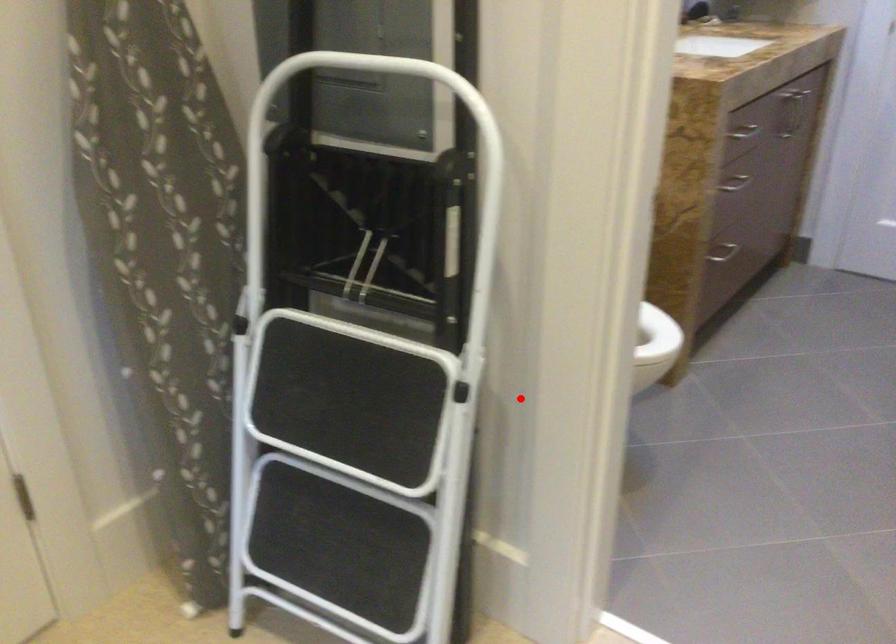
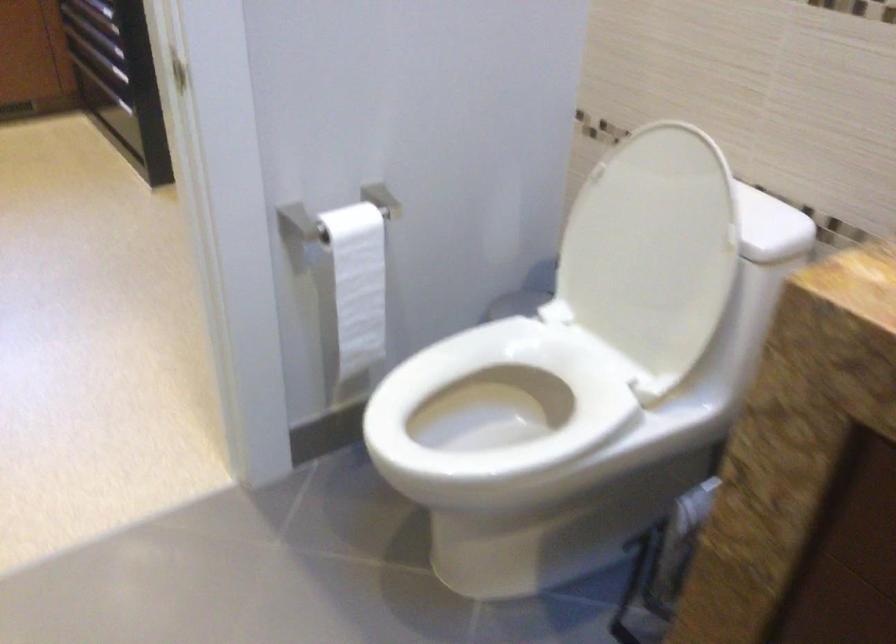
In the second image, find the point that corresponds to the highlighted location in the first image.

(357, 283)